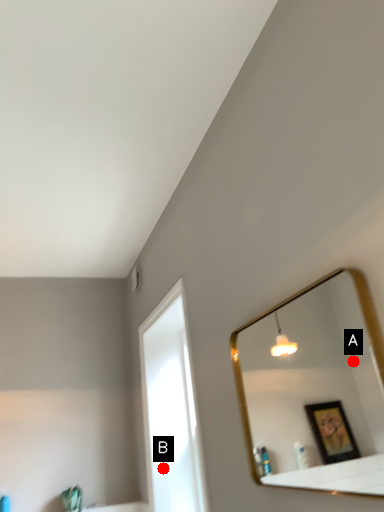
Question: Two points are circled on the image, labeled by A and B beside each circle. Among these points, which one is farthest from the camera?

Choices:
 (A) A is further
 (B) B is further

Answer: (A)